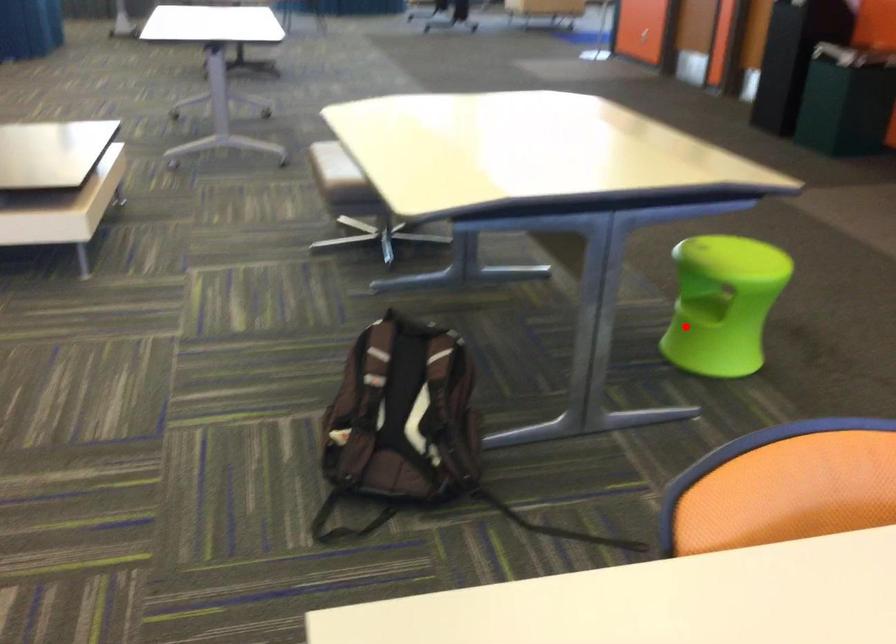
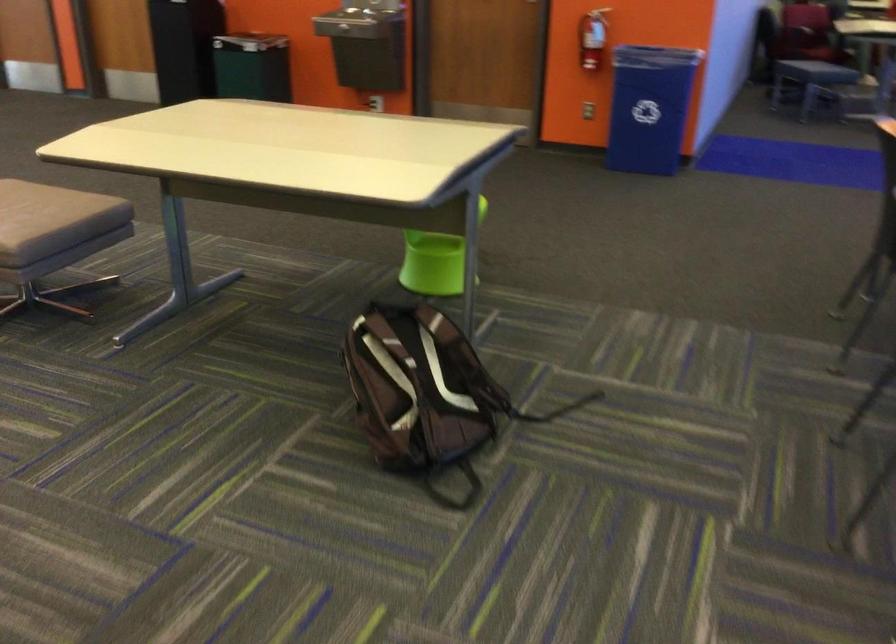
Question: A red point is marked in image1. In image2, is the corresponding 3D point closer to the camera or farther? Reply with the corresponding letter.

Choices:
 (A) The corresponding 3D point is closer.
 (B) The corresponding 3D point is farther.

Answer: (B)